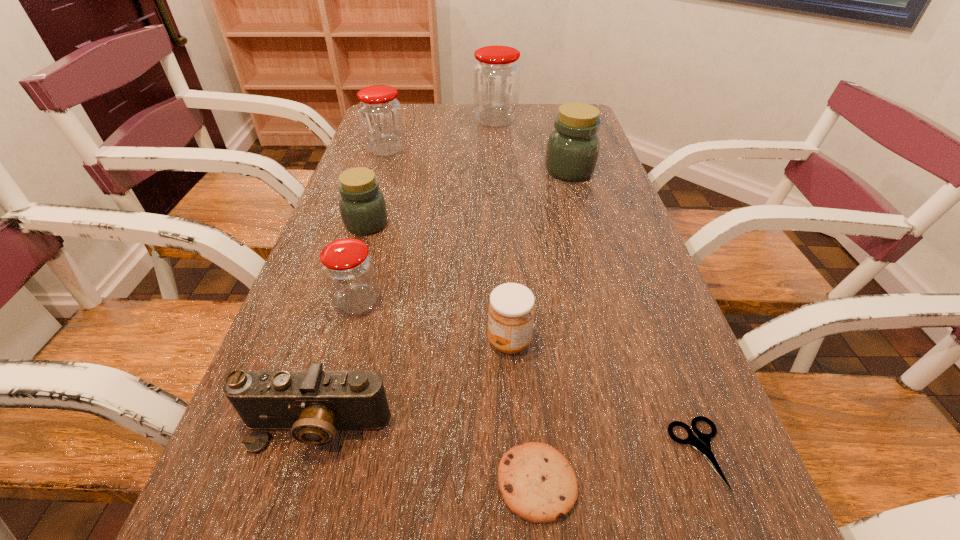
Where is `vacant region located on the front label of the fourth nearest object`? The width and height of the screenshot is (960, 540). vacant region located on the front label of the fourth nearest object is located at coordinates (325, 341).

The width and height of the screenshot is (960, 540). I want to click on vacant space located 0.350m on the front label of the fourth nearest object, so click(299, 341).

Locate an element on the screen. Image resolution: width=960 pixels, height=540 pixels. vacant space positioned on the right of the cookie is located at coordinates (736, 482).

Locate an element on the screen. vacant space positioned 0.220m on the back of the shears is located at coordinates (648, 315).

At what (x,y) coordinates should I click in order to perform the action: click on object that is at the far edge. Please return your answer as a coordinate pair (x, y). This screenshot has width=960, height=540. Looking at the image, I should click on (496, 75).

Where is `camera positioned at the left edge`? The image size is (960, 540). camera positioned at the left edge is located at coordinates click(313, 404).

The height and width of the screenshot is (540, 960). What are the coordinates of `jar that is at the right edge` in the screenshot? It's located at (572, 151).

At what (x,y) coordinates should I click in order to perform the action: click on shears that is at the right edge. Please return your answer as a coordinate pair (x, y). The height and width of the screenshot is (540, 960). Looking at the image, I should click on (702, 443).

The height and width of the screenshot is (540, 960). I want to click on vacant space at the far edge of the desktop, so click(x=458, y=133).

Locate an element on the screen. This screenshot has width=960, height=540. vacant area at the left edge of the desktop is located at coordinates (384, 191).